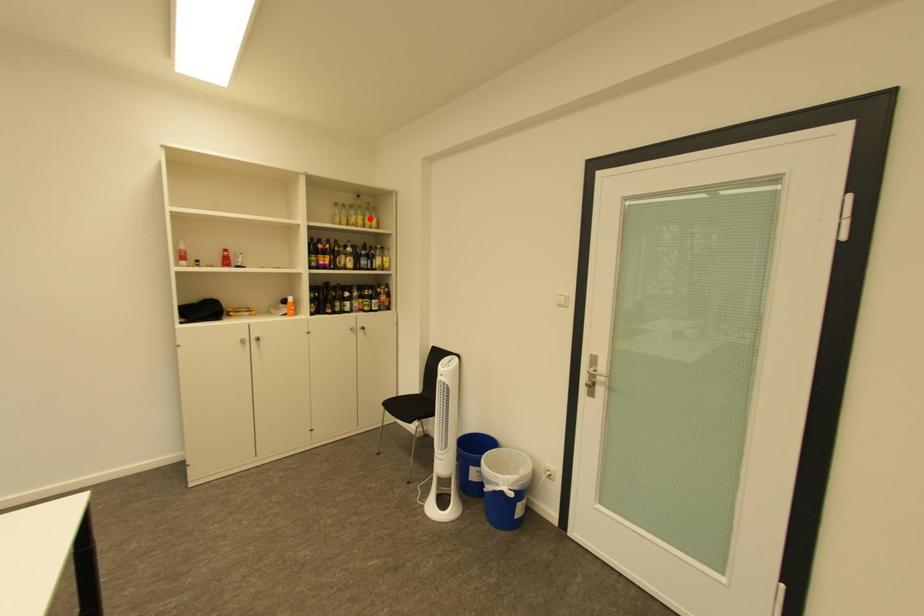
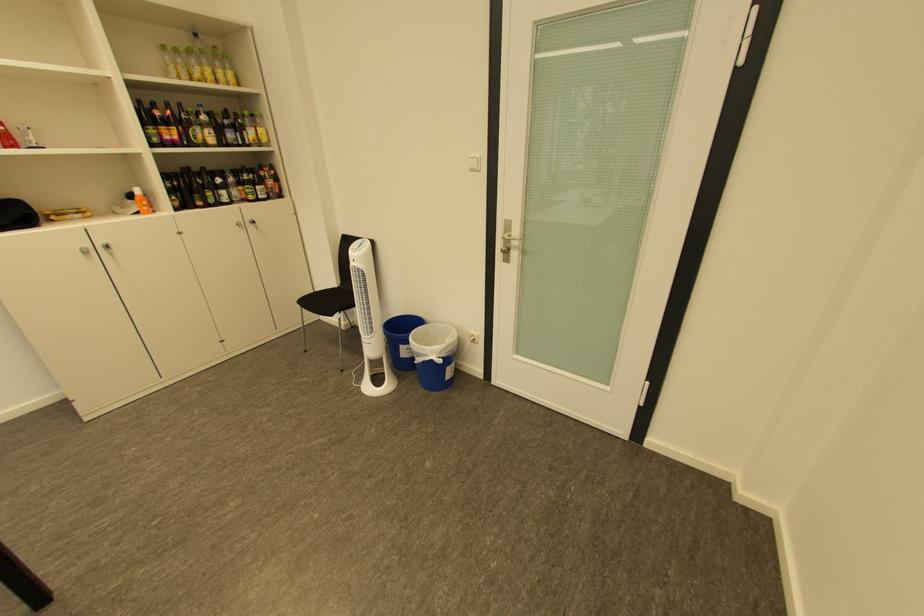
Question: I am providing you with two images of the same scene from different viewpoints. A red point is shown in image1. For the corresponding object point in image2, is it positioned nearer or farther from the camera?

Choices:
 (A) Nearer
 (B) Farther

Answer: (B)